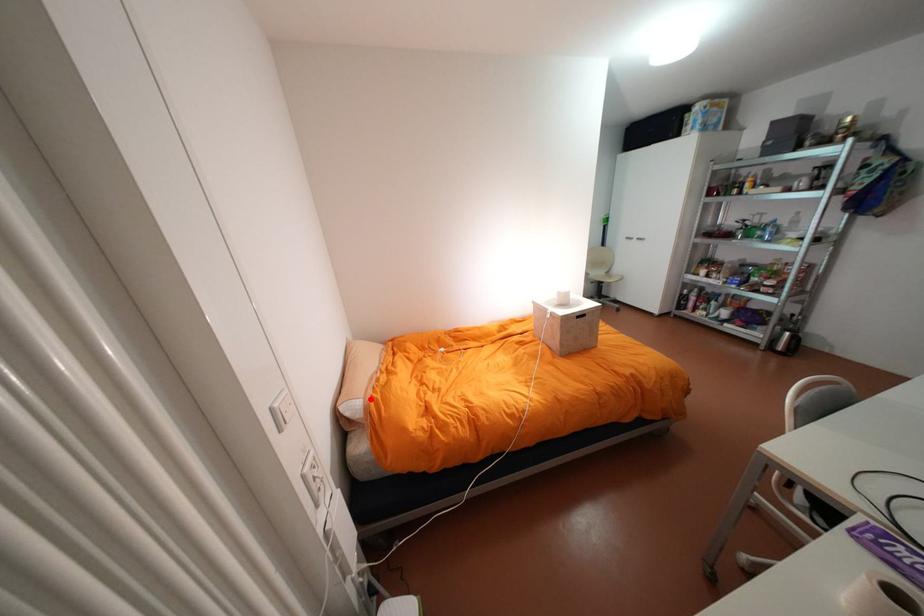
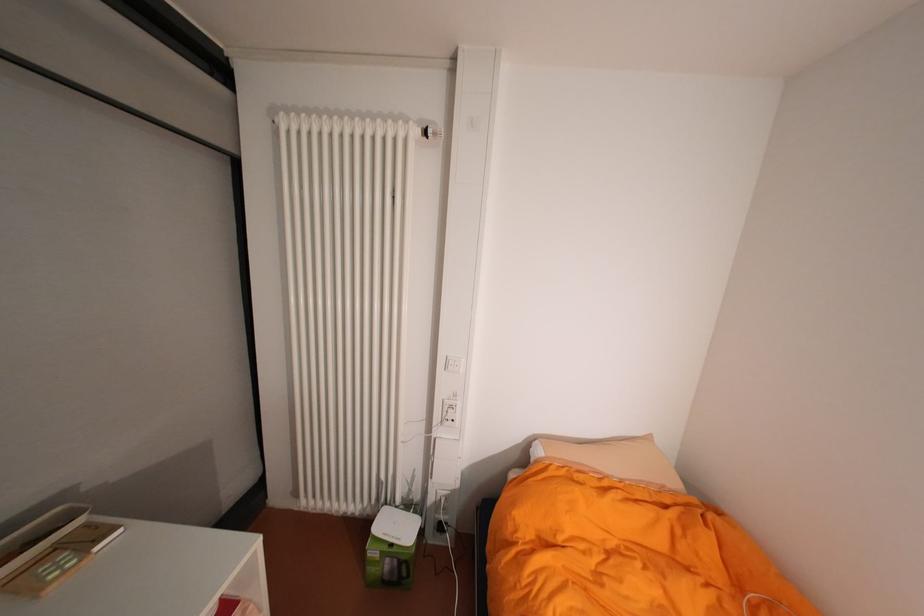
Find the pixel in the second image that matches the highlighted location in the first image.

(553, 454)